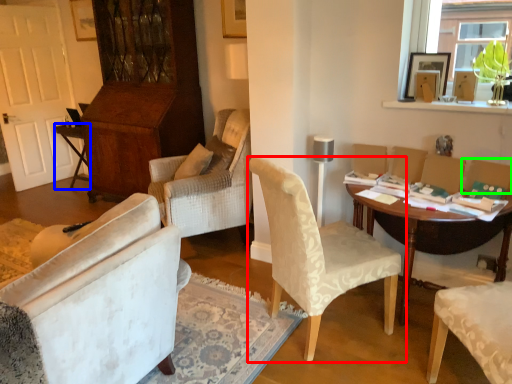
Question: Estimate the real-world distances between objects in this image. Which object is closer to chair (highlighted by a red box), table (highlighted by a blue box) or armchair (highlighted by a green box)?

Choices:
 (A) table
 (B) armchair

Answer: (B)